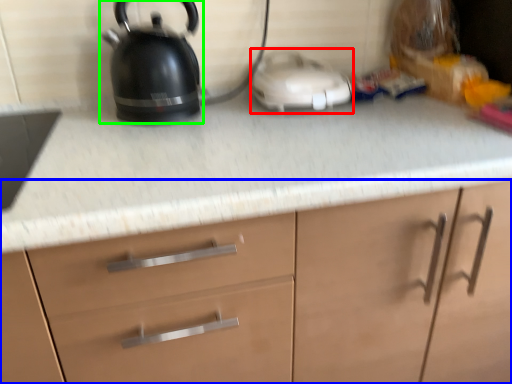
Question: Based on their relative distances, which object is nearer to appliance (highlighted by a red box)? Choose from cabinetry (highlighted by a blue box) and kettle (highlighted by a green box).

Choices:
 (A) cabinetry
 (B) kettle

Answer: (B)